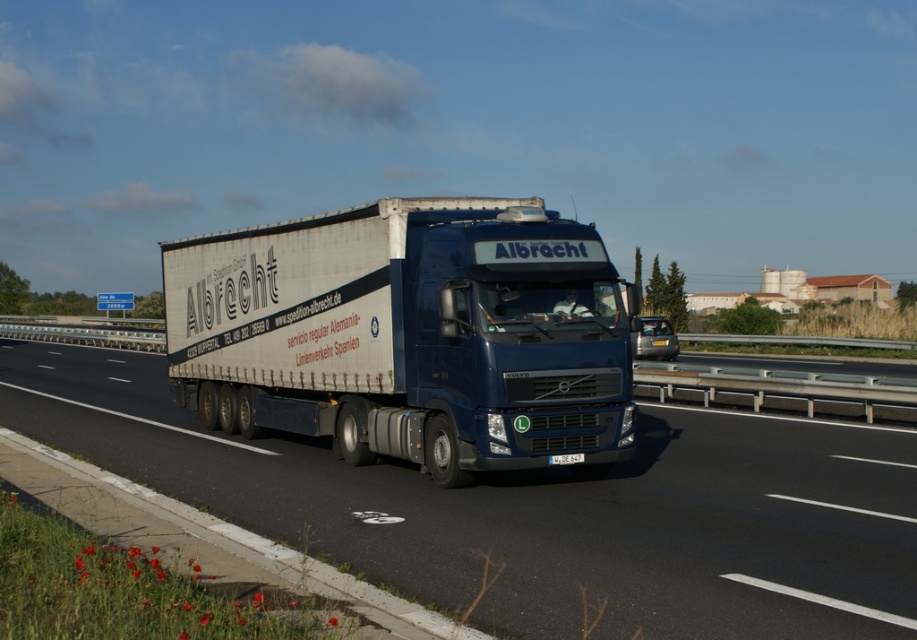
Question: Does white matte truck at center come behind matte blue truck at center?

Choices:
 (A) yes
 (B) no

Answer: (B)

Question: Is white matte truck at center to the left of matte blue truck at center from the viewer's perspective?

Choices:
 (A) yes
 (B) no

Answer: (A)

Question: Among these objects, which one is farthest from the camera?

Choices:
 (A) white matte truck at center
 (B) matte blue truck at center

Answer: (B)

Question: Is white matte truck at center above matte blue truck at center?

Choices:
 (A) yes
 (B) no

Answer: (B)